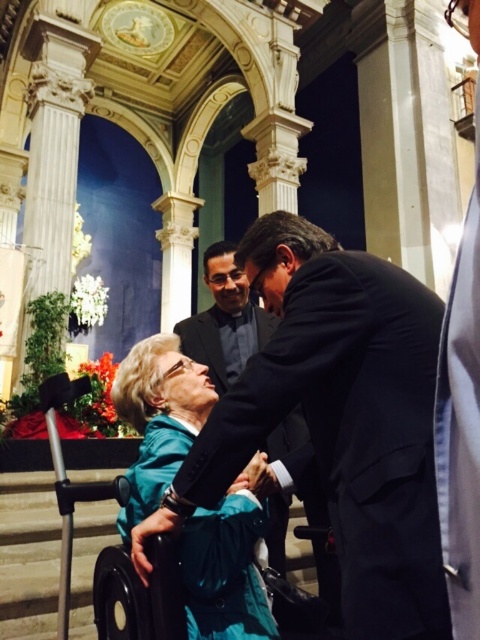
Question: Which object is farther from the camera taking this photo?

Choices:
 (A) smooth skin hand at center
 (B) black suit at center
 (C) black satin suit at center
 (D) teal fabric wheelchair at lower left

Answer: (A)

Question: Can you confirm if black suit at center is wider than teal fabric wheelchair at lower left?

Choices:
 (A) no
 (B) yes

Answer: (B)

Question: Is black suit at center closer to the viewer compared to teal fabric wheelchair at lower left?

Choices:
 (A) no
 (B) yes

Answer: (B)

Question: Among these objects, which one is farthest from the camera?

Choices:
 (A) teal fabric wheelchair at lower left
 (B) black suit at center
 (C) black satin suit at center

Answer: (A)

Question: Which of the following is the farthest from the observer?

Choices:
 (A) (338, 372)
 (B) (255, 486)
 (C) (241, 509)
 (D) (228, 310)

Answer: (D)

Question: Is black satin suit at center wider than smooth skin hand at center?

Choices:
 (A) yes
 (B) no

Answer: (A)